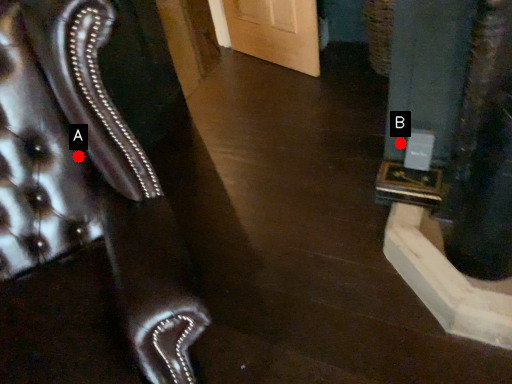
Question: Two points are circled on the image, labeled by A and B beside each circle. Which point is closer to the camera?

Choices:
 (A) A is closer
 (B) B is closer

Answer: (A)